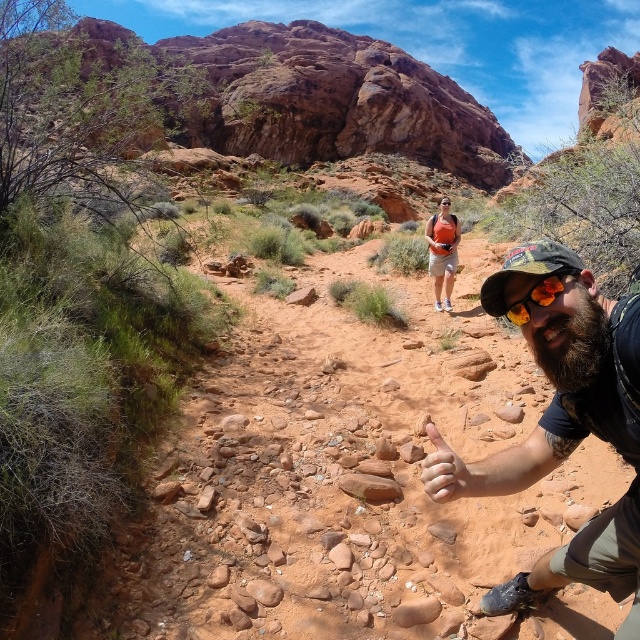
Between point (611, 541) and point (538, 301), which one is positioned in front?

Point (538, 301) is in front.

Is bearded man at center taller than orange reflective goggles at center?

Indeed, bearded man at center has a greater height compared to orange reflective goggles at center.

Does point (563, 266) lie behind point (509, 310)?

No, (563, 266) is closer to viewer.

Locate an element on the screen. Image resolution: width=640 pixels, height=640 pixels. bearded man at center is located at coordinates coord(563,426).

Is bearded man at center to the right of orange backpack at center from the viewer's perspective?

Incorrect, bearded man at center is not on the right side of orange backpack at center.

Between bearded man at center and orange backpack at center, which one has more height?

orange backpack at center

The height and width of the screenshot is (640, 640). I want to click on bearded man at center, so click(x=563, y=426).

Can you confirm if orange backpack at center is bigger than orange reflective goggles at center?

Indeed, orange backpack at center has a larger size compared to orange reflective goggles at center.

How much distance is there between orange backpack at center and orange reflective goggles at center?

orange backpack at center and orange reflective goggles at center are 14.11 meters apart from each other.

Which is behind, point (440, 285) or point (552, 273)?

The point (440, 285) is behind.

Locate an element on the screen. The width and height of the screenshot is (640, 640). orange backpack at center is located at coordinates (442, 252).